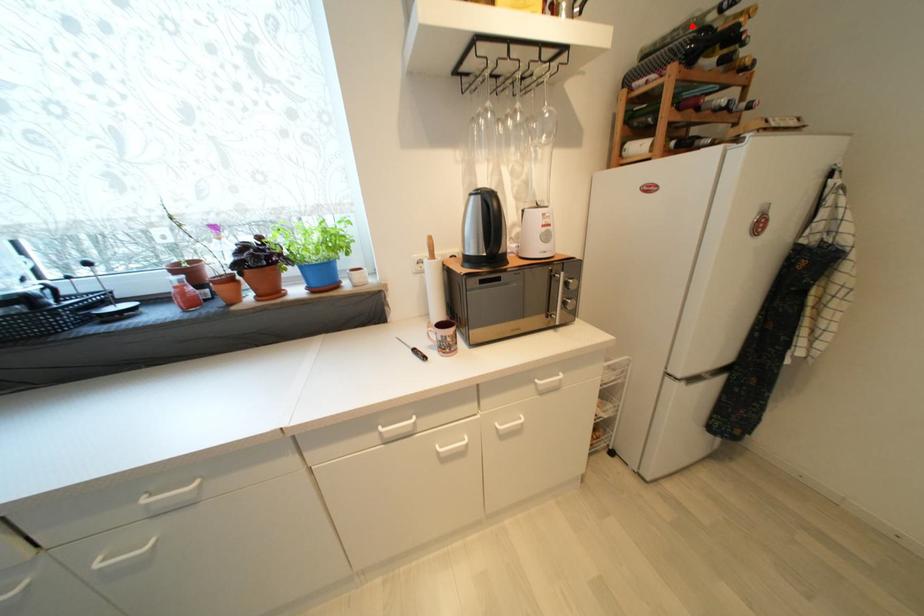
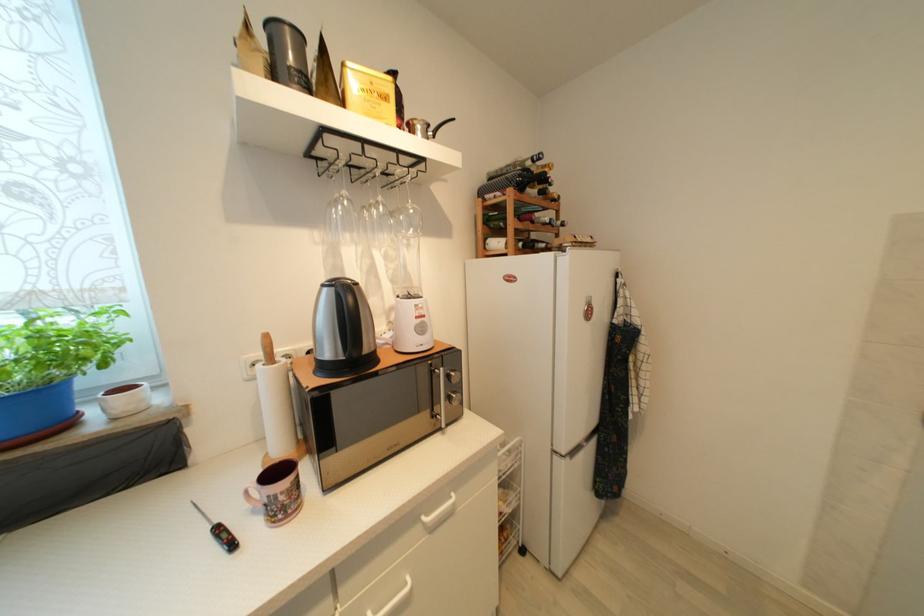
Where in the second image is the point corresponding to the highlighted location from the first image?

(518, 166)